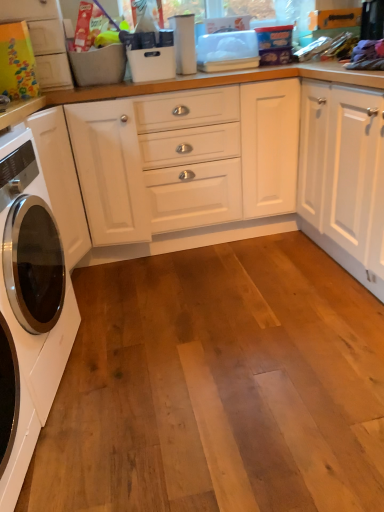
Find the location of a particular element. white glossy washing machine at left is located at coordinates [x=29, y=308].

Describe the element at coordinates (29, 308) in the screenshot. I see `white glossy washing machine at left` at that location.

Describe the element at coordinates (43, 39) in the screenshot. I see `matte cardboard box at upper left` at that location.

Measure the distance between point (0, 22) and camera.

6.06 feet.

Find the location of a particular element. The height and width of the screenshot is (512, 384). matte cardboard box at upper left is located at coordinates (43, 39).

The image size is (384, 512). I want to click on white glossy washing machine at left, so click(x=29, y=308).

Visually, is white glossy washing machine at left positioned to the left or to the right of matte cardboard box at upper left?

In the image, white glossy washing machine at left appears on the right side of matte cardboard box at upper left.

Is white glossy washing machine at left further to the viewer compared to matte cardboard box at upper left?

No, it is not.

Does point (53, 344) appear closer or farther from the camera than point (17, 18)?

Clearly, point (53, 344) is closer to the camera than point (17, 18).

From the image's perspective, between white glossy washing machine at left and matte cardboard box at upper left, which one is located above?

From the image's view, matte cardboard box at upper left is above.

From a real-world perspective, which object stands above the other?

matte cardboard box at upper left is physically above.

Between white glossy washing machine at left and matte cardboard box at upper left, which one has larger width?

With larger width is white glossy washing machine at left.

Who is taller, white glossy washing machine at left or matte cardboard box at upper left?

→ white glossy washing machine at left is taller.

Looking at this image, based on their sizes in the image, would you say white glossy washing machine at left is bigger or smaller than matte cardboard box at upper left?

In the image, white glossy washing machine at left appears to be larger than matte cardboard box at upper left.

Do you think white glossy washing machine at left is within matte cardboard box at upper left, or outside of it?

white glossy washing machine at left cannot be found inside matte cardboard box at upper left.

Is white glossy washing machine at left far from matte cardboard box at upper left?

No, white glossy washing machine at left is in close proximity to matte cardboard box at upper left.

Could you tell me if white glossy washing machine at left is turned towards matte cardboard box at upper left?

No, white glossy washing machine at left does not turn towards matte cardboard box at upper left.

From the picture: Can you tell me how much white glossy washing machine at left and matte cardboard box at upper left differ in facing direction?

The angle between the facing direction of white glossy washing machine at left and the facing direction of matte cardboard box at upper left is 81.6 degrees.

Measure the distance between white glossy washing machine at left and matte cardboard box at upper left.

white glossy washing machine at left is 36.84 inches from matte cardboard box at upper left.

Where is `washing machine that appears on the right of matte cardboard box at upper left`? washing machine that appears on the right of matte cardboard box at upper left is located at coordinates (29, 308).

Is matte cardboard box at upper left to the left or to the right of white glossy washing machine at left in the image?

From the image, it's evident that matte cardboard box at upper left is to the left of white glossy washing machine at left.

Which is in front, matte cardboard box at upper left or white glossy washing machine at left?

white glossy washing machine at left is more forward.

Is point (62, 30) closer to camera compared to point (4, 335)?

No.

From the image's perspective, is matte cardboard box at upper left on top of white glossy washing machine at left?

Yes, from the image's perspective, matte cardboard box at upper left is above white glossy washing machine at left.

From a real-world perspective, is matte cardboard box at upper left beneath white glossy washing machine at left?

Incorrect, from a real-world perspective, matte cardboard box at upper left is higher than white glossy washing machine at left.

Can you confirm if matte cardboard box at upper left is wider than white glossy washing machine at left?

No.

From their relative heights in the image, would you say matte cardboard box at upper left is taller or shorter than white glossy washing machine at left?

matte cardboard box at upper left is shorter than white glossy washing machine at left.

Is matte cardboard box at upper left smaller than white glossy washing machine at left?

Correct, matte cardboard box at upper left occupies less space than white glossy washing machine at left.

Is matte cardboard box at upper left not within white glossy washing machine at left?

Yes, matte cardboard box at upper left is not within white glossy washing machine at left.

Is matte cardboard box at upper left not near white glossy washing machine at left?

No, matte cardboard box at upper left is in close proximity to white glossy washing machine at left.

In the scene shown: Is matte cardboard box at upper left aimed at white glossy washing machine at left?

No, matte cardboard box at upper left is not facing towards white glossy washing machine at left.

Find the location of `cabinetry above the white glossy washing machine at left (from a real-world perspective)`. cabinetry above the white glossy washing machine at left (from a real-world perspective) is located at coordinates (43, 39).

The width and height of the screenshot is (384, 512). I want to click on cabinetry that is above the white glossy washing machine at left (from a real-world perspective), so click(43, 39).

In order to click on washing machine below the matte cardboard box at upper left (from the image's perspective) in this screenshot , I will do `click(29, 308)`.